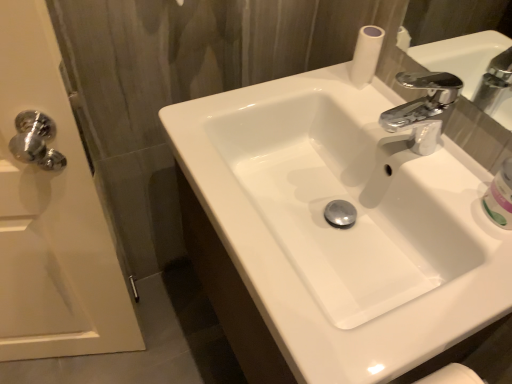
Question: Is white glossy door handle at left thinner than white glossy sink at center?

Choices:
 (A) yes
 (B) no

Answer: (A)

Question: Can you confirm if white glossy door handle at left is positioned to the right of white glossy sink at center?

Choices:
 (A) no
 (B) yes

Answer: (A)

Question: From the image's perspective, is white glossy door handle at left located above white glossy sink at center?

Choices:
 (A) yes
 (B) no

Answer: (B)

Question: Is white glossy door handle at left oriented towards white glossy sink at center?

Choices:
 (A) yes
 (B) no

Answer: (B)

Question: Are white glossy door handle at left and white glossy sink at center far apart?

Choices:
 (A) yes
 (B) no

Answer: (B)

Question: Is white glossy door handle at left facing away from white glossy sink at center?

Choices:
 (A) no
 (B) yes

Answer: (A)

Question: Can you confirm if white glossy sink at center is shorter than white glossy door handle at left?

Choices:
 (A) yes
 (B) no

Answer: (A)

Question: Does white glossy sink at center have a larger size compared to white glossy door handle at left?

Choices:
 (A) no
 (B) yes

Answer: (B)

Question: Does white glossy sink at center touch white glossy door handle at left?

Choices:
 (A) no
 (B) yes

Answer: (A)

Question: Is white glossy door handle at left inside white glossy sink at center?

Choices:
 (A) yes
 (B) no

Answer: (B)

Question: Is white glossy sink at center smaller than white glossy door handle at left?

Choices:
 (A) yes
 (B) no

Answer: (B)

Question: Can you confirm if white glossy sink at center is thinner than white glossy door handle at left?

Choices:
 (A) yes
 (B) no

Answer: (B)

Question: Is white glossy mouthwash at right not close to white glossy door handle at left?

Choices:
 (A) no
 (B) yes

Answer: (A)